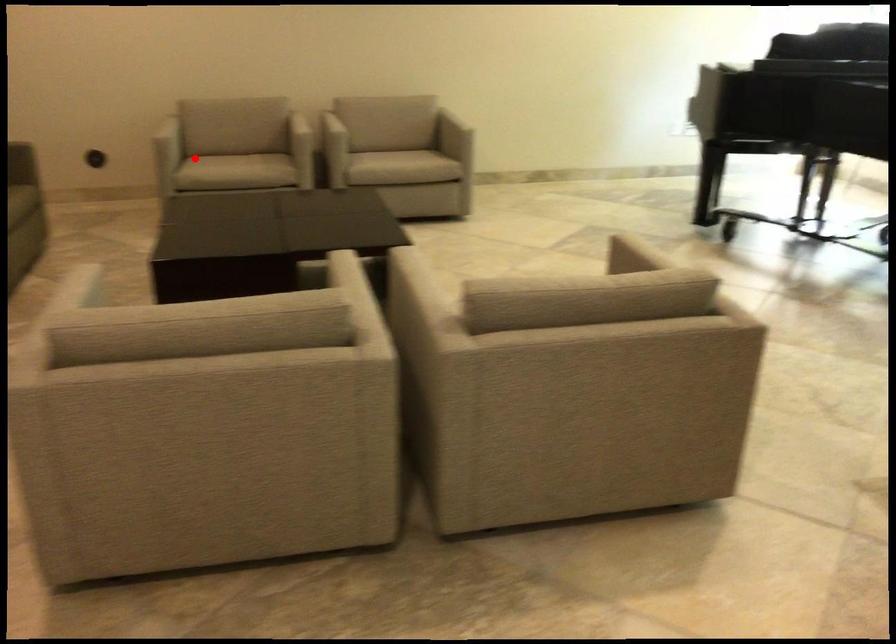
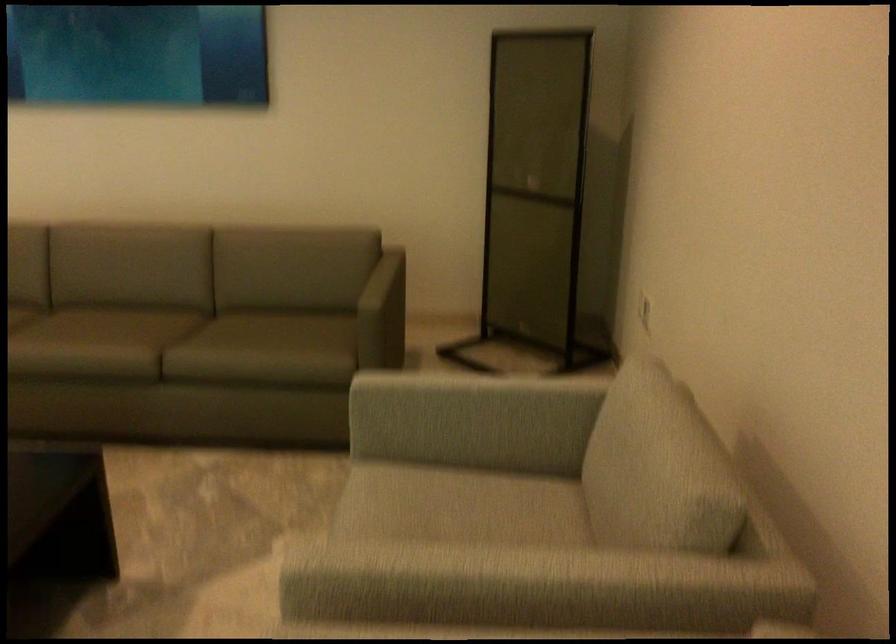
Find the pixel in the second image that matches the highlighted location in the first image.

(455, 491)